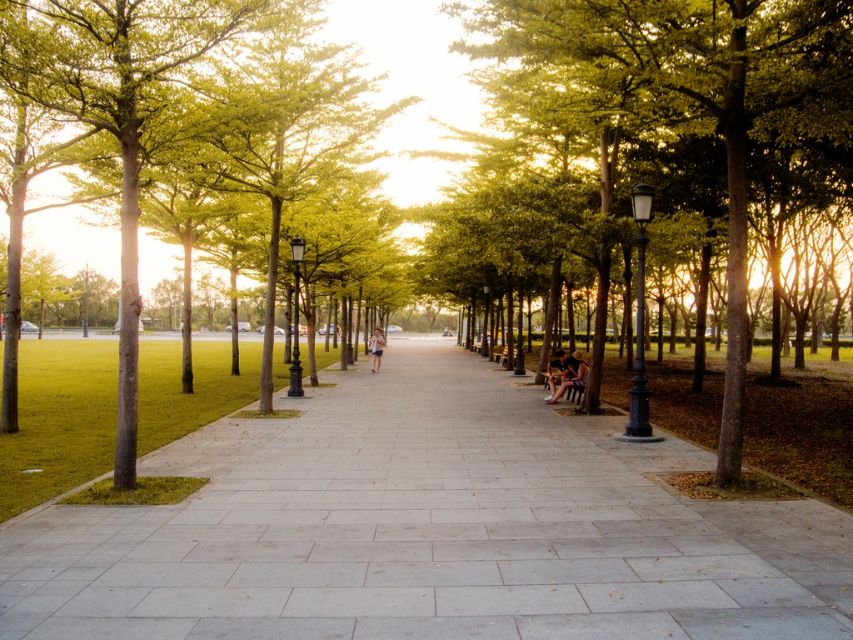
You are a pedestrian walking along the gray concrete pavement at center and the green leafy tree at center. Which object is located to your left as you face the direction of the path?

The gray concrete pavement at center is positioned on the left side of green leafy tree at center, so when facing the direction of the path, the gray concrete pavement at center would be to your left.

You are standing at the point labeled point (427,529) in the park. What is the material of the surface you are currently standing on?

The surface at point (427,529) is gray concrete pavement.